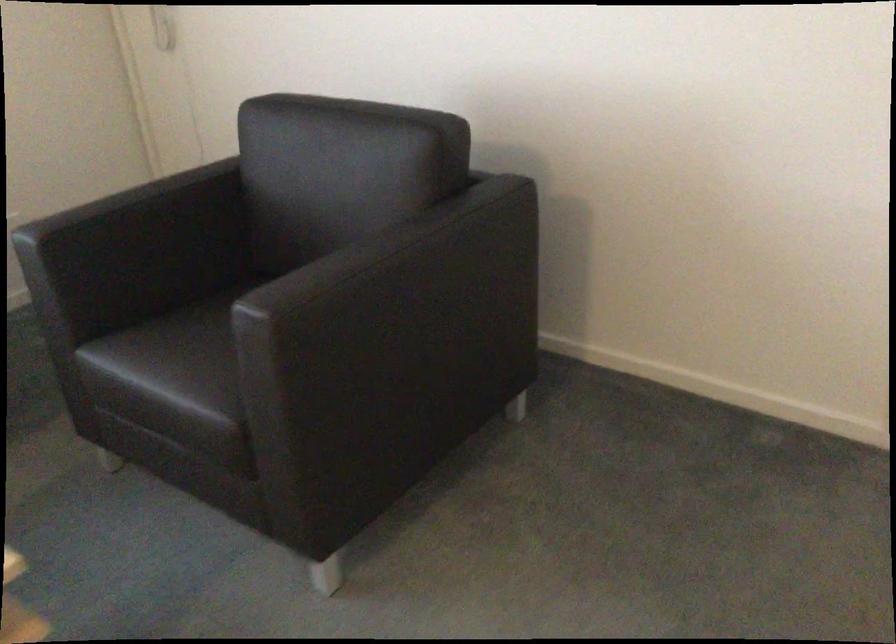
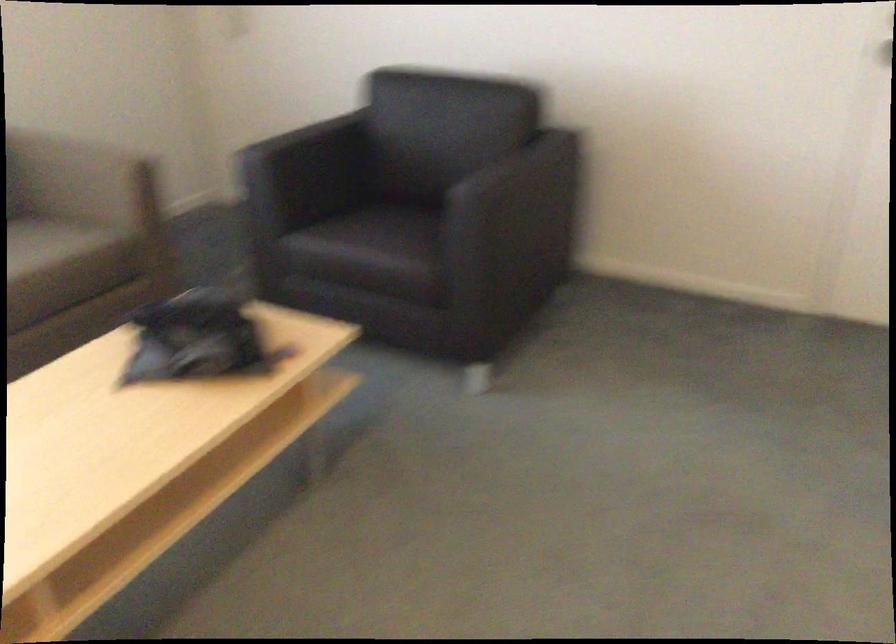
From the picture: In a continuous first-person perspective shot, in which direction is the camera moving?

The cameraman walked toward left, backward.